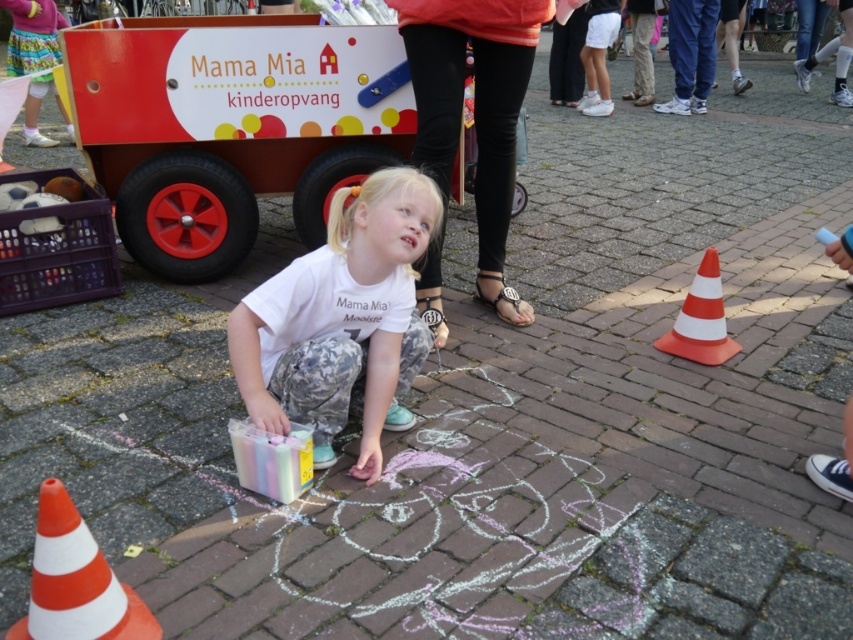
Question: Based on their relative distances, which object is nearer to the black leather pants at center?

Choices:
 (A) orange/white striped cone at right
 (B) white matte shirt at center

Answer: (B)

Question: Can you confirm if orange/white plastic cone at lower left is positioned to the left of orange/white striped cone at right?

Choices:
 (A) yes
 (B) no

Answer: (A)

Question: Which object is farther from the camera taking this photo?

Choices:
 (A) white matte shirt at center
 (B) black leather pants at center

Answer: (B)

Question: Can you confirm if matte white wagon at center is thinner than white matte shirt at center?

Choices:
 (A) no
 (B) yes

Answer: (A)

Question: Does white matte shirt at center appear on the left side of orange/white plastic cone at lower left?

Choices:
 (A) yes
 (B) no

Answer: (B)

Question: Which point appears closest to the camera in this image?

Choices:
 (A) (722, 346)
 (B) (274, 172)
 (C) (409, 340)

Answer: (C)